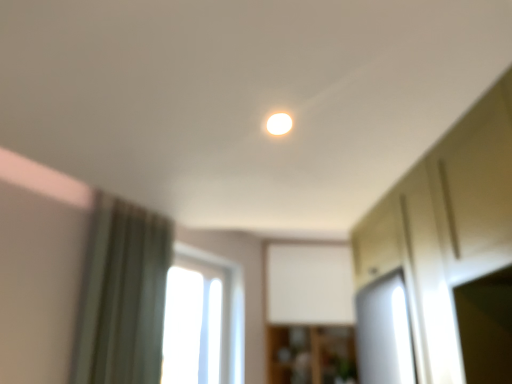
Question: Does wooden cabinet at center have a greater height compared to transparent glass window at center?

Choices:
 (A) yes
 (B) no

Answer: (B)

Question: From the image's perspective, is wooden cabinet at center located beneath transparent glass window at center?

Choices:
 (A) no
 (B) yes

Answer: (B)

Question: Is transparent glass window at center at the back of wooden cabinet at center?

Choices:
 (A) no
 (B) yes

Answer: (A)

Question: From a real-world perspective, is wooden cabinet at center below transparent glass window at center?

Choices:
 (A) no
 (B) yes

Answer: (B)

Question: Is transparent glass window at center completely or partially inside wooden cabinet at center?

Choices:
 (A) no
 (B) yes

Answer: (A)

Question: From the image's perspective, is transparent glass window at center positioned above or below wooden cabinet at center?

Choices:
 (A) below
 (B) above

Answer: (B)

Question: Looking at their shapes, would you say transparent glass window at center is wider or thinner than wooden cabinet at center?

Choices:
 (A) wide
 (B) thin

Answer: (B)

Question: Visually, is transparent glass window at center positioned to the left or to the right of wooden cabinet at center?

Choices:
 (A) left
 (B) right

Answer: (A)

Question: From a real-world perspective, is transparent glass window at center above or below wooden cabinet at center?

Choices:
 (A) above
 (B) below

Answer: (A)

Question: Relative to transparent glass window at center, is wooden cabinet at center in front or behind?

Choices:
 (A) front
 (B) behind

Answer: (B)

Question: Looking at their shapes, would you say wooden cabinet at center is wider or thinner than transparent glass window at center?

Choices:
 (A) wide
 (B) thin

Answer: (A)

Question: Is wooden cabinet at center bigger or smaller than transparent glass window at center?

Choices:
 (A) small
 (B) big

Answer: (B)

Question: From their relative heights in the image, would you say wooden cabinet at center is taller or shorter than transparent glass window at center?

Choices:
 (A) short
 (B) tall

Answer: (A)

Question: From the image's perspective, is wooden cabinet at center located above or below matte white light at center?

Choices:
 (A) above
 (B) below

Answer: (B)

Question: From a real-world perspective, is wooden cabinet at center above or below matte white light at center?

Choices:
 (A) below
 (B) above

Answer: (A)